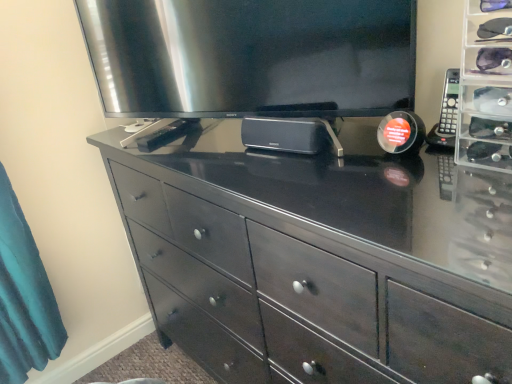
The width and height of the screenshot is (512, 384). I want to click on free location to the left of black plastic remote at right, so 388,165.